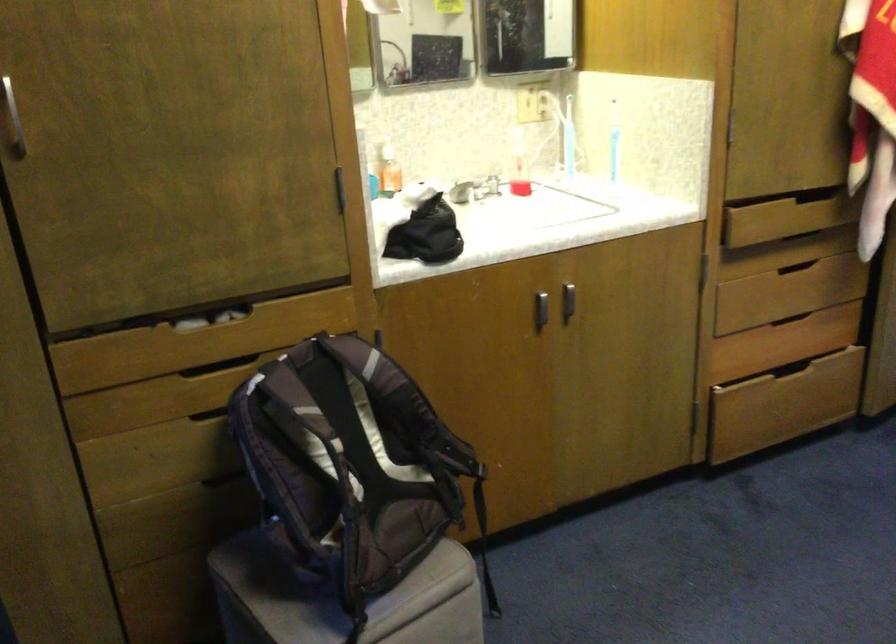
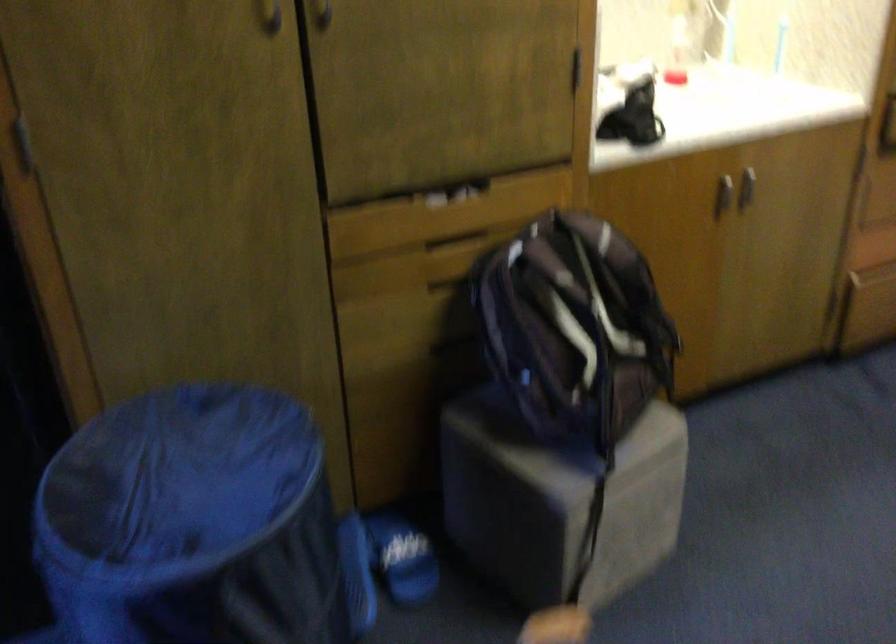
Find the pixel in the second image that matches [388,442] in the first image.

(607, 310)